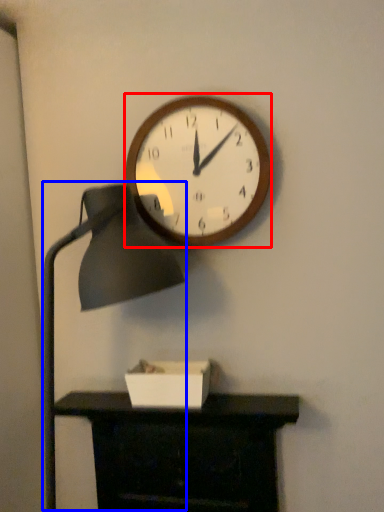
Question: Among these objects, which one is farthest to the camera, wall clock (highlighted by a red box) or table lamp (highlighted by a blue box)?

Choices:
 (A) wall clock
 (B) table lamp

Answer: (A)